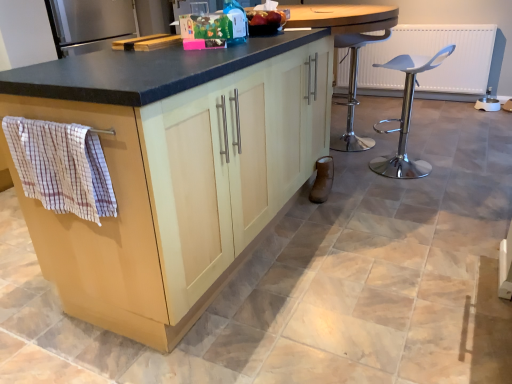
Image resolution: width=512 pixels, height=384 pixels. What are the coordinates of `unoccupied area in front of white plastic stool at right` in the screenshot? It's located at (416, 191).